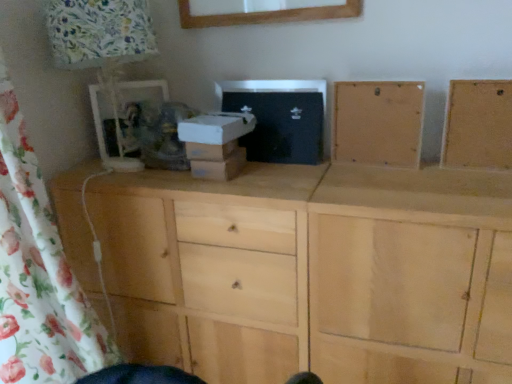
Question: Does white cardboard box at center have a larger size compared to floral fabric lampshade at left?

Choices:
 (A) no
 (B) yes

Answer: (A)

Question: Considering the relative sizes of white cardboard box at center and floral fabric lampshade at left in the image provided, is white cardboard box at center shorter than floral fabric lampshade at left?

Choices:
 (A) no
 (B) yes

Answer: (B)

Question: Is white cardboard box at center positioned far away from floral fabric lampshade at left?

Choices:
 (A) no
 (B) yes

Answer: (A)

Question: Can you confirm if white cardboard box at center is taller than floral fabric lampshade at left?

Choices:
 (A) no
 (B) yes

Answer: (A)

Question: From a real-world perspective, is white cardboard box at center on floral fabric lampshade at left?

Choices:
 (A) yes
 (B) no

Answer: (B)

Question: Is white cardboard box at center oriented towards floral fabric lampshade at left?

Choices:
 (A) no
 (B) yes

Answer: (A)

Question: Is natural wood cabinet at center at the right side of natural wood frame at upper right, which is the 1th cabinetry from right to left?

Choices:
 (A) yes
 (B) no

Answer: (B)

Question: Can you confirm if natural wood cabinet at center is smaller than natural wood frame at upper right, which is the 1th cabinetry from right to left?

Choices:
 (A) yes
 (B) no

Answer: (B)

Question: Is natural wood cabinet at center outside natural wood frame at upper right, positioned as the second cabinetry in left-to-right order?

Choices:
 (A) no
 (B) yes

Answer: (B)

Question: From a real-world perspective, is natural wood cabinet at center on natural wood frame at upper right, positioned as the second cabinetry in left-to-right order?

Choices:
 (A) no
 (B) yes

Answer: (A)

Question: Are natural wood cabinet at center and natural wood frame at upper right, which is the 1th cabinetry from right to left, located far from each other?

Choices:
 (A) yes
 (B) no

Answer: (B)

Question: Is natural wood cabinet at center positioned before natural wood frame at upper right, positioned as the second cabinetry in left-to-right order?

Choices:
 (A) no
 (B) yes

Answer: (B)

Question: Considering the relative sizes of floral fabric lampshade at left and natural wood frame at upper right, positioned as the second cabinetry in left-to-right order, in the image provided, is floral fabric lampshade at left taller than natural wood frame at upper right, positioned as the second cabinetry in left-to-right order,?

Choices:
 (A) no
 (B) yes

Answer: (B)